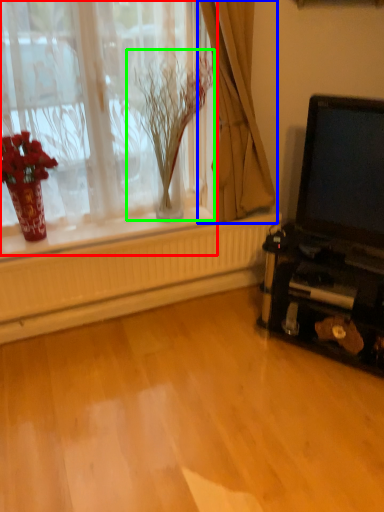
Question: Considering the real-world distances, which object is closest to window (highlighted by a red box)? curtain (highlighted by a blue box) or plant (highlighted by a green box).

Choices:
 (A) curtain
 (B) plant

Answer: (B)